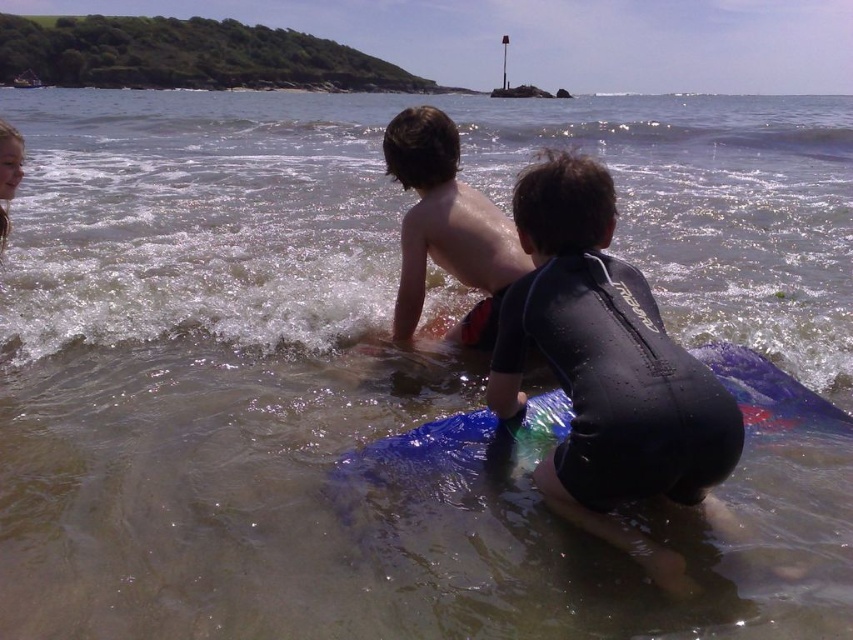
Does black wetsuit at center come in front of blue rubber surfboard at lower center?

Yes, it is.

Does point (723, 400) come farther from viewer compared to point (445, 460)?

That is False.

Find the location of a particular element. This screenshot has height=640, width=853. black wetsuit at center is located at coordinates (606, 368).

Who is more distant from viewer, (459, 330) or (531, 438)?

Point (459, 330)

Does shiny wet skin at center appear on the left side of blue rubber surfboard at lower center?

Correct, you'll find shiny wet skin at center to the left of blue rubber surfboard at lower center.

Which is in front, point (438, 122) or point (757, 413)?

Point (757, 413) is in front.

Where is `shiny wet skin at center`? The width and height of the screenshot is (853, 640). shiny wet skin at center is located at coordinates (447, 227).

Is black wetsuit at center to the right of shiny wet skin at center from the viewer's perspective?

Correct, you'll find black wetsuit at center to the right of shiny wet skin at center.

How far apart are black wetsuit at center and shiny wet skin at center?

3.74 feet

Which is behind, point (541, 288) or point (426, 170)?

The point (426, 170) is behind.

Find the location of a particular element. This screenshot has width=853, height=640. black wetsuit at center is located at coordinates (606, 368).